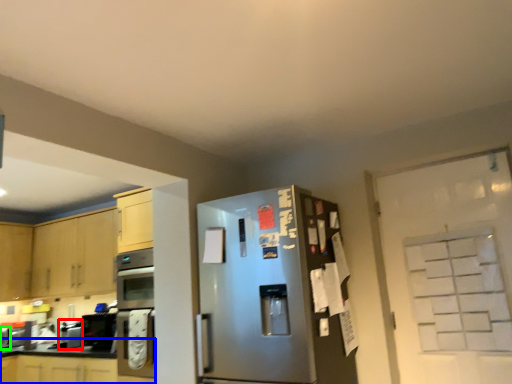
Question: Which object is the closest to the appliance (highlighted by a red box)? Choose among these: cabinetry (highlighted by a blue box) or appliance (highlighted by a green box).

Choices:
 (A) cabinetry
 (B) appliance

Answer: (A)